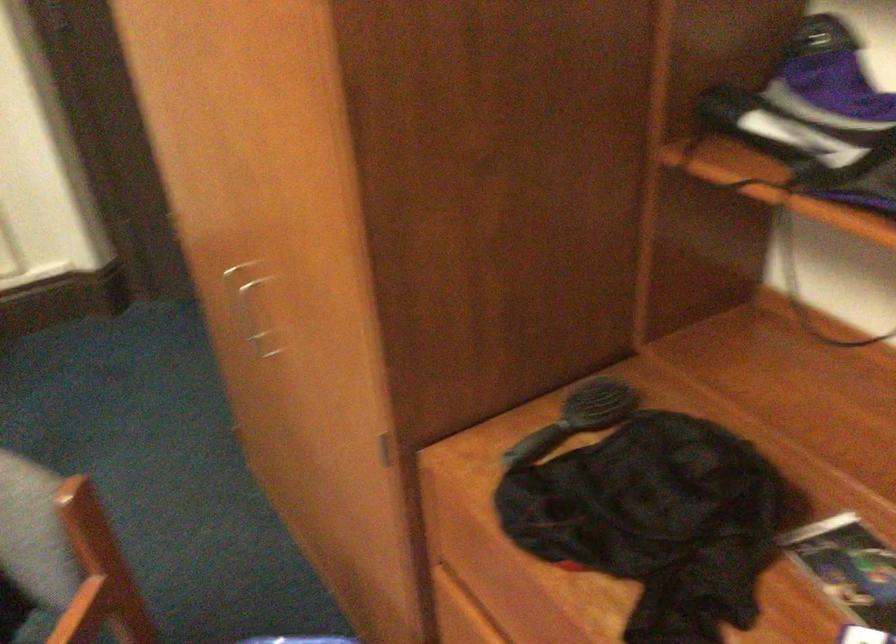
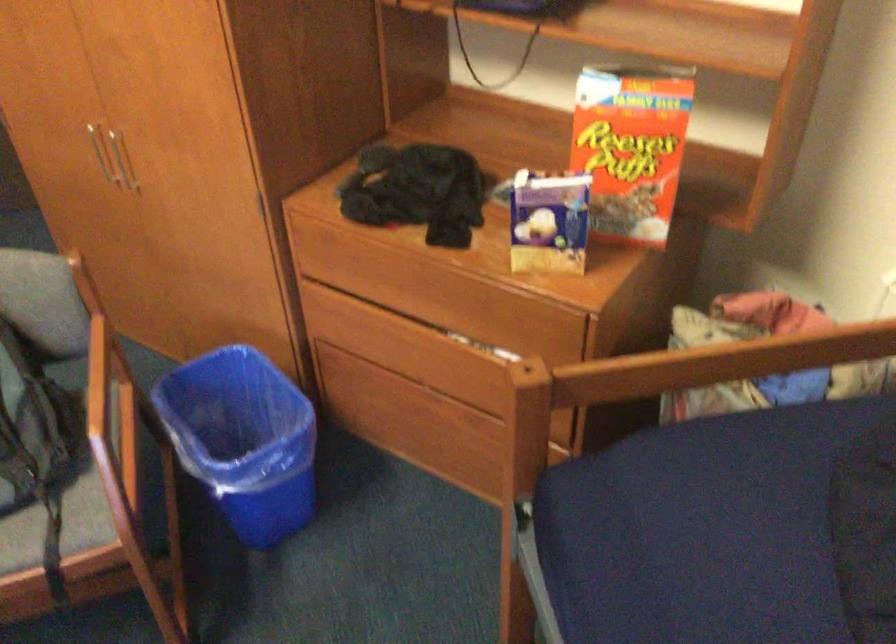
In the second image, find the point that corresponds to point (256, 319) in the first image.

(122, 160)